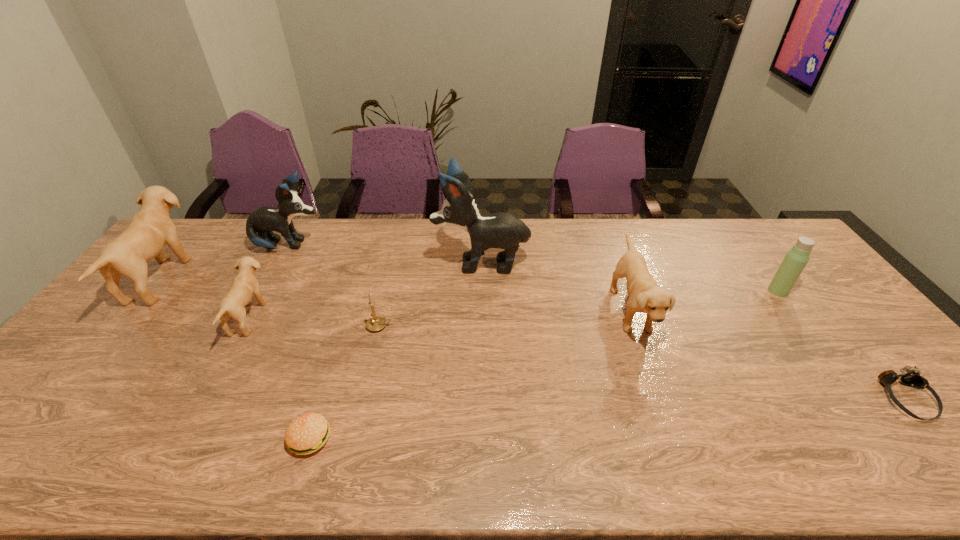
Identify the location of the right black puppy. This screenshot has width=960, height=540. (501, 230).

What are the coordinates of `the bigger black puppy` in the screenshot? It's located at (501, 230).

What are the coordinates of `the left black puppy` in the screenshot? It's located at (265, 220).

Where is `the leftmost puppy`? the leftmost puppy is located at coordinates (151, 228).

In order to click on the leftmost beige puppy in this screenshot , I will do `click(151, 228)`.

The width and height of the screenshot is (960, 540). I want to click on the fourth tallest puppy, so click(x=645, y=296).

The image size is (960, 540). I want to click on the rightmost puppy, so click(x=645, y=296).

Where is `the second object from right to left`? This screenshot has height=540, width=960. the second object from right to left is located at coordinates (794, 262).

Locate an element on the screen. Image resolution: width=960 pixels, height=540 pixels. light thermos bottle is located at coordinates pyautogui.click(x=794, y=262).

Locate an element on the screen. The height and width of the screenshot is (540, 960). the second beige puppy from right to left is located at coordinates (244, 285).